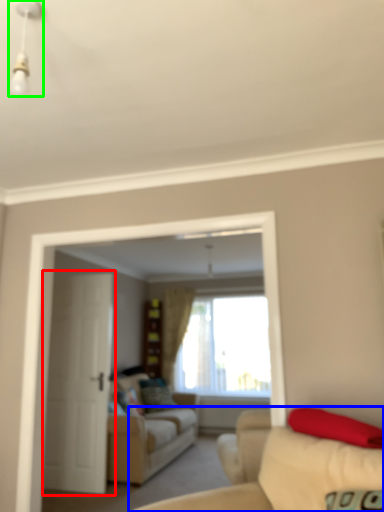
Question: Which object is positioned farthest from door (highlighted by a red box)? Select from studio couch (highlighted by a blue box) and light fixture (highlighted by a green box).

Choices:
 (A) studio couch
 (B) light fixture

Answer: (B)